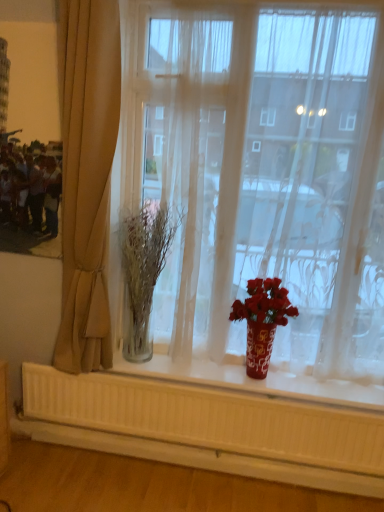
Question: Does shiny red vase at center appear on the right side of clear glass vase at center?

Choices:
 (A) no
 (B) yes

Answer: (B)

Question: Does shiny red vase at center have a smaller size compared to clear glass vase at center?

Choices:
 (A) no
 (B) yes

Answer: (B)

Question: Would you say shiny red vase at center is outside clear glass vase at center?

Choices:
 (A) no
 (B) yes

Answer: (B)

Question: Does shiny red vase at center have a larger size compared to clear glass vase at center?

Choices:
 (A) no
 (B) yes

Answer: (A)

Question: From a real-world perspective, is shiny red vase at center beneath clear glass vase at center?

Choices:
 (A) yes
 (B) no

Answer: (A)

Question: Is shiny red vase at center taller than clear glass vase at center?

Choices:
 (A) yes
 (B) no

Answer: (B)

Question: From a real-world perspective, is clear glass vase at center beneath beige fabric curtain at left?

Choices:
 (A) no
 (B) yes

Answer: (B)

Question: Considering the relative sizes of clear glass vase at center and beige fabric curtain at left in the image provided, is clear glass vase at center smaller than beige fabric curtain at left?

Choices:
 (A) no
 (B) yes

Answer: (B)

Question: Does clear glass vase at center have a larger size compared to beige fabric curtain at left?

Choices:
 (A) yes
 (B) no

Answer: (B)

Question: Considering the relative positions of clear glass vase at center and beige fabric curtain at left in the image provided, is clear glass vase at center to the left of beige fabric curtain at left from the viewer's perspective?

Choices:
 (A) yes
 (B) no

Answer: (B)

Question: Could you tell me if clear glass vase at center is facing beige fabric curtain at left?

Choices:
 (A) yes
 (B) no

Answer: (B)

Question: Does clear glass vase at center contain beige fabric curtain at left?

Choices:
 (A) yes
 (B) no

Answer: (B)

Question: From the image's perspective, is beige fabric curtain at left beneath transparent glass vase at center?

Choices:
 (A) no
 (B) yes

Answer: (B)